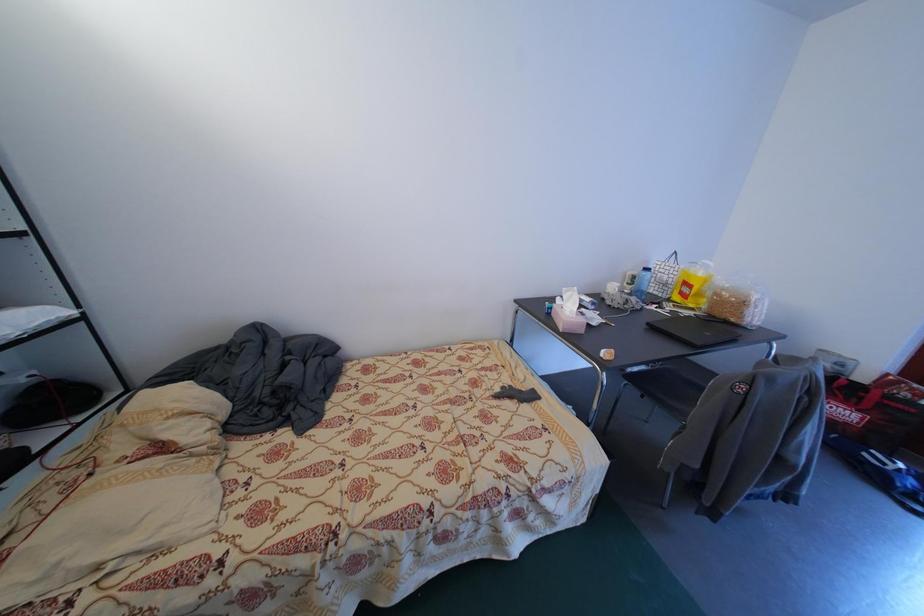
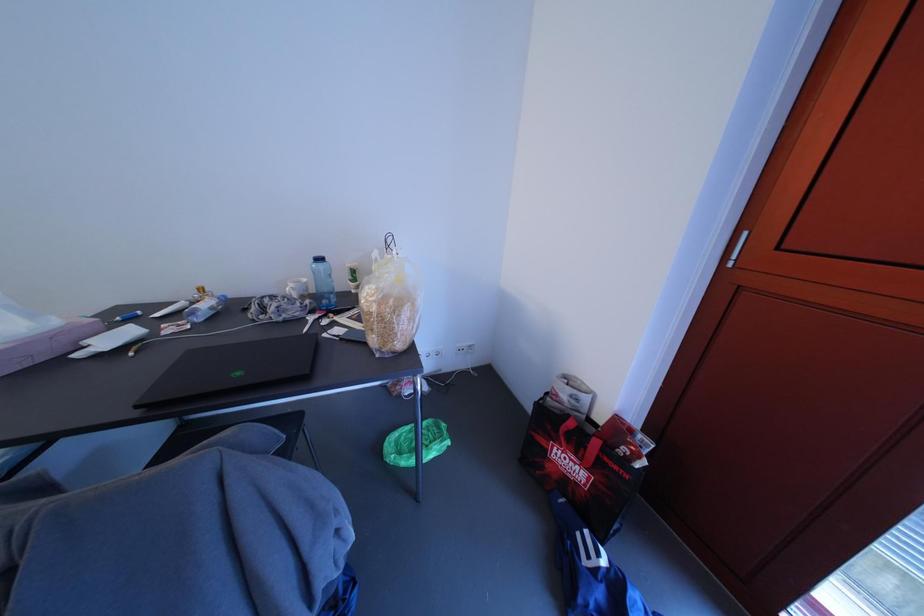
Question: The images are taken continuously from a first-person perspective. In which direction are you moving?

Choices:
 (A) Left
 (B) Right
 (C) Forward
 (D) Backward

Answer: (B)